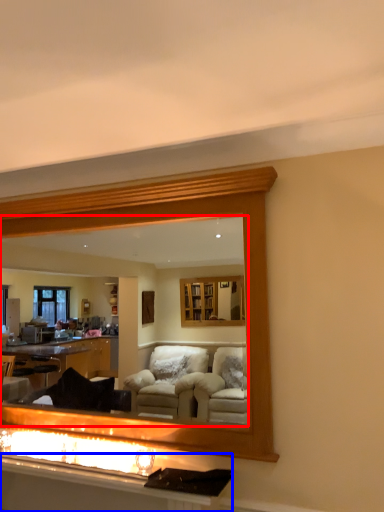
Question: Which object is closer to the camera taking this photo, mirror (highlighted by a red box) or vanity (highlighted by a blue box)?

Choices:
 (A) mirror
 (B) vanity

Answer: (B)